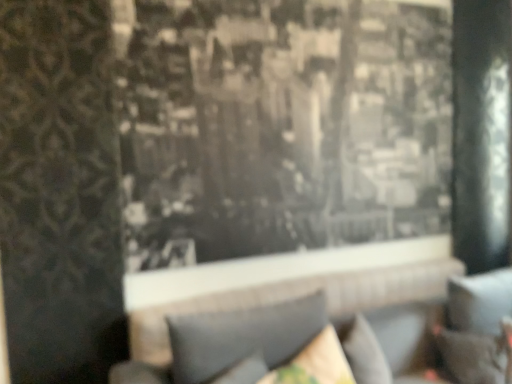
You are a GUI agent. You are given a task and a screenshot of the screen. Output one action in this format:
    pyautogui.click(x=<x>, y=<y>)
    Task: Click on the free region under black textured fabric at center (from a real-world perspective)
    
    Given the screenshot: What is the action you would take?
    pyautogui.click(x=304, y=277)